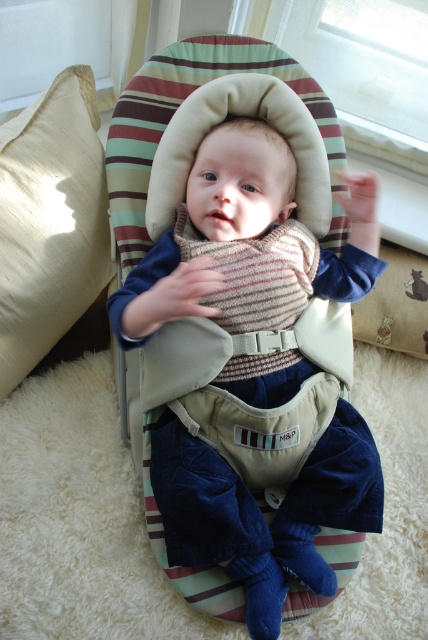
Looking at this image, you are a photographer setting up for a baby photoshoot. The baby is sitting in a bouncer on a rug. You need to place a prop near the striped knit sweater at center so it can be in the frame. Where should you place the prop relative to the sweater?

The striped knit sweater at center is located at point [244,243], so you should place the prop near that coordinate to ensure it stays in the frame.

You are a parent trying to place a striped knit sweater at center and a beige fabric pillow at left on a shelf. The shelf has a height limit of 10 cm. Can both items fit vertically without exceeding the height limit?

The striped knit sweater at center has a greater height compared to beige fabric pillow at left. Since the sweater is taller than the pillow, but the total height of both items combined may exceed the 10 cm limit. However, the description only provides a comparison between the two items, not their exact heights. Without knowing the exact heights, it is impossible to determine if both can fit within the 10 cm limit.

From the picture: You are a parent trying to place a small toy between the striped knit sweater at center and the beige fabric pillow at left so that it stays centered between them. Given that the toy is 10 centimeters wide, will it fit perfectly without overlapping either object?

The distance between the striped knit sweater at center and the beige fabric pillow at left is 37.04 centimeters. The toy is 10 centimeters wide, so there will be enough space to place it between them without overlapping since 37.04 cm is greater than 10 cm. However, the question mentions centering the toy between them. The center point would be at 18.52 cm from each object. Placing a 10 cm toy centered would require at least 5 cm on each side from the center point, totaling 10 cm. Since the total distance